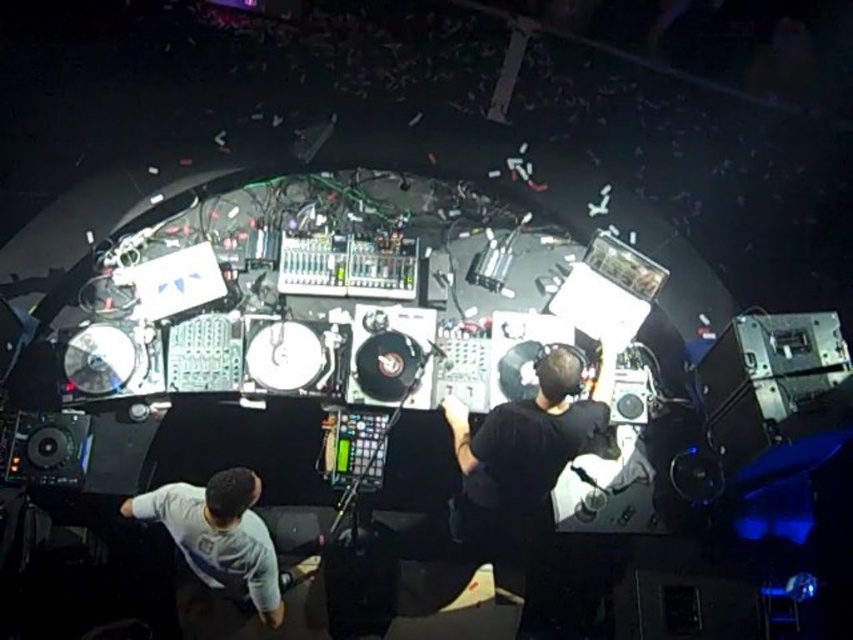
Is black matte headphones at center to the left of white matte shirt at lower left from the viewer's perspective?

No, black matte headphones at center is not to the left of white matte shirt at lower left.

Between black matte headphones at center and white matte shirt at lower left, which one has less height?

Standing shorter between the two is white matte shirt at lower left.

Find the location of a particular element. black matte headphones at center is located at coordinates (524, 449).